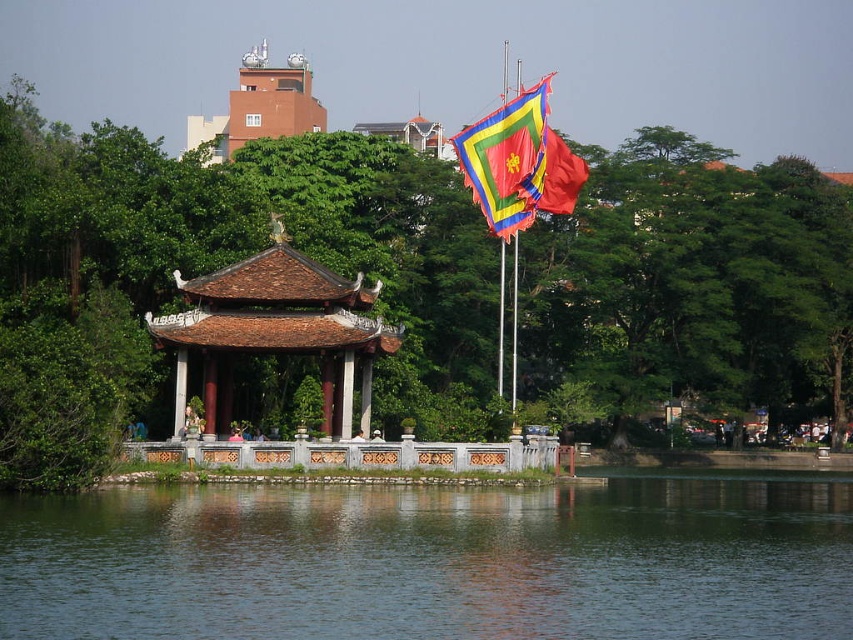
You are standing at the entrance of the traditional pavilion and want to locate the green leafy tree at center. According to the coordinates given, in which direction should you look to find it?

The green leafy tree at center is located at coordinates point (395, 291). Since the pavilion is at the center of the image, you should look directly ahead to find the green leafy tree at center.

You are standing at the entrance of the park, which is at point 0.0, 0.0. You want to go to the brown tiled gazebo at center. What direction should you walk in?

Since the brown tiled gazebo at center is located at point (276, 332), you should walk northeast to reach it from the entrance at (0, 0).